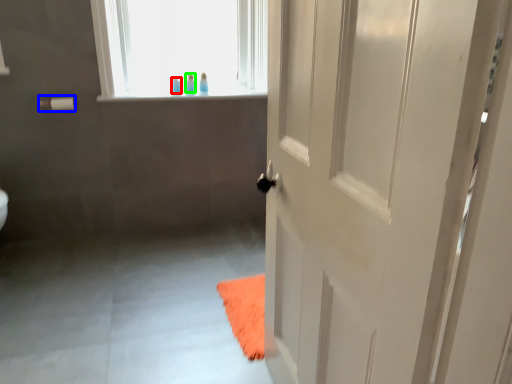
Question: Estimate the real-world distances between objects in this image. Which object is closer to toiletry (highlighted by a red box), towel bar (highlighted by a blue box) or toiletry (highlighted by a green box)?

Choices:
 (A) towel bar
 (B) toiletry

Answer: (B)